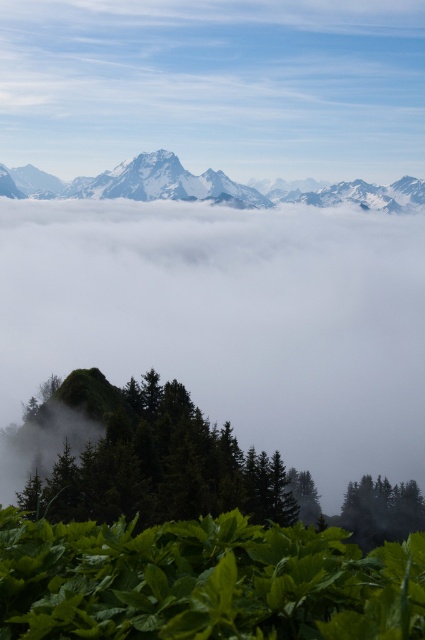
You are standing in the misty mountain landscape and see two points marked in the image. The first point is at coordinates point [323,604] and the second is at point [396,196]. Which point is physically closer to your current position?

Point [323,604] is closer to the viewer than point [396,196], so the first point is physically closer to your current position.

You are standing at the point labeled point (127,365) and want to walk towards the point labeled point (396,182). Given the mountainous terrain described, will you be moving upwards or downwards in elevation?

Since point (127,365) is closer to the camera than point (396,182), you will be moving upwards in elevation as you walk towards the latter point.

You are standing at the camera position looking at the mountain landscape. There are two points marked in the image, one at coordinates point (68, 486) and the other at point (149, 193). Which point is nearer to you?

Point (68, 486) is closer to the camera than point (149, 193), so the point at (68, 486) is nearer to you.